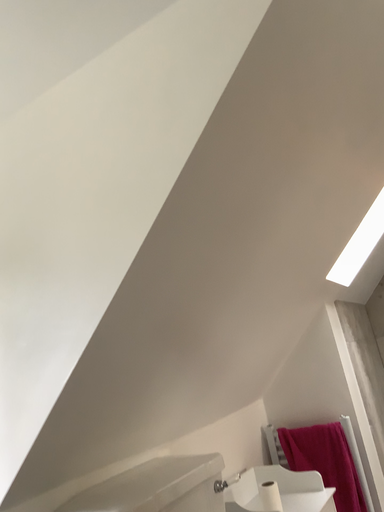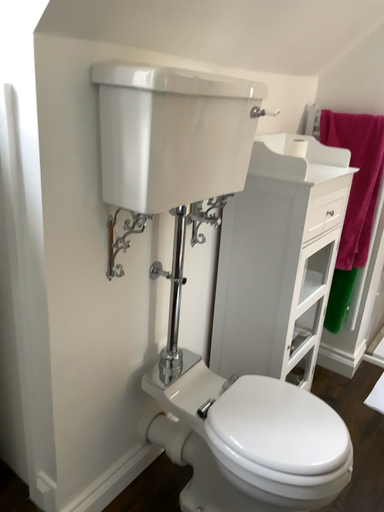
Question: Which way did the camera rotate in the video?

Choices:
 (A) rotated downward
 (B) rotated upward

Answer: (A)